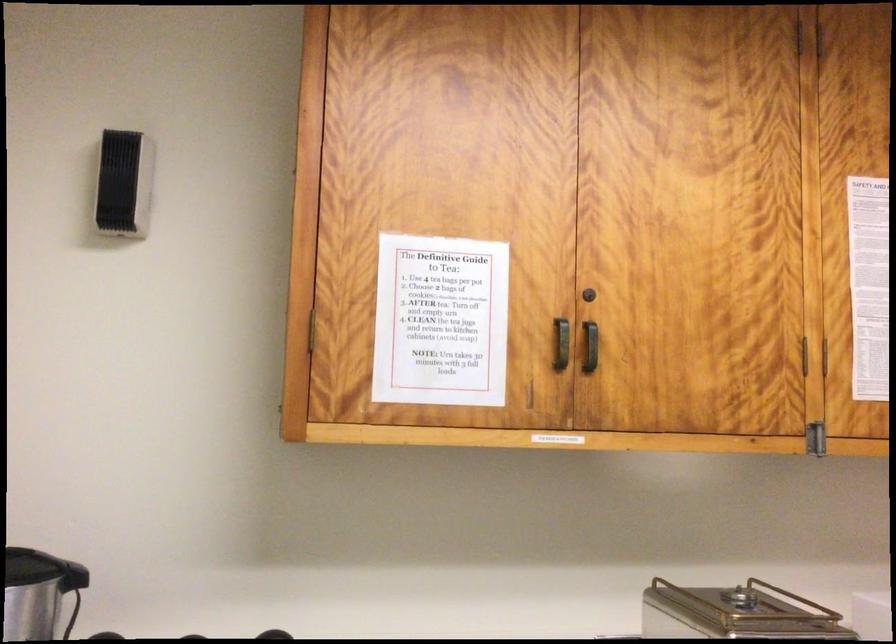
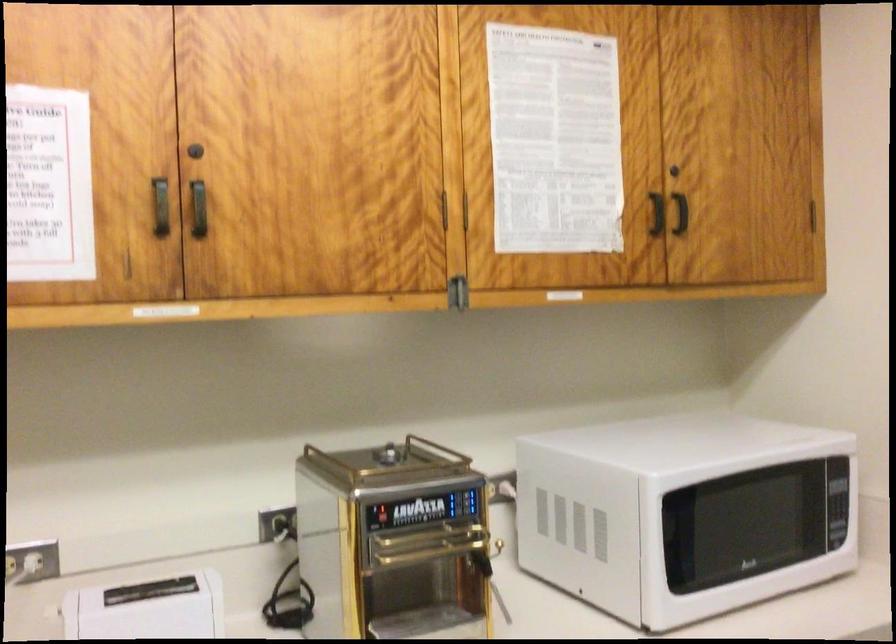
Where in the second image is the point corresponding to (561,346) from the first image?

(159, 205)